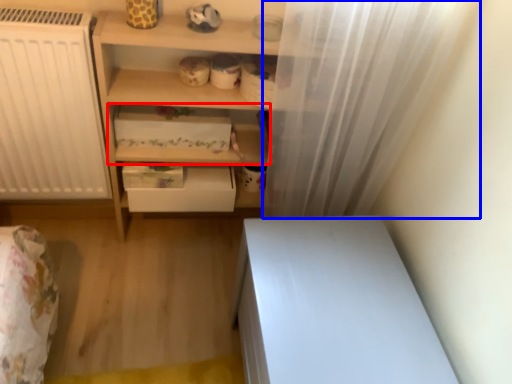
Question: Which object appears farthest to the camera in this image, shelf (highlighted by a red box) or shower curtain (highlighted by a blue box)?

Choices:
 (A) shelf
 (B) shower curtain

Answer: (A)